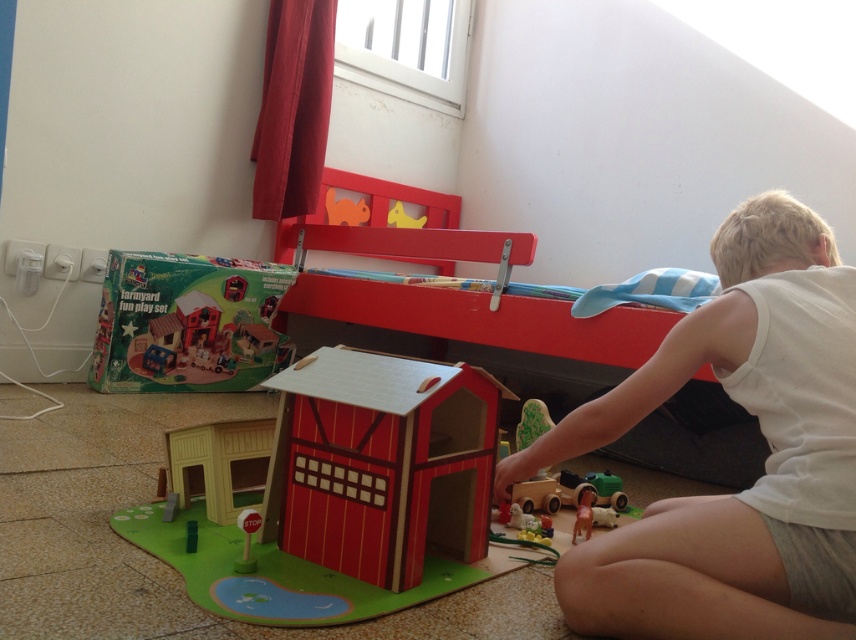
Question: Is wooden barn at center further to camera compared to matte red bunk bed at upper center?

Choices:
 (A) no
 (B) yes

Answer: (A)

Question: Can you confirm if white cotton shirt at lower right is positioned to the right of wooden barn at center?

Choices:
 (A) yes
 (B) no

Answer: (A)

Question: Where is wooden barn at center located in relation to matte red bunk bed at upper center in the image?

Choices:
 (A) right
 (B) left

Answer: (B)

Question: Estimate the real-world distances between objects in this image. Which object is closer to the matte red bunk bed at upper center?

Choices:
 (A) matte cardboard farmyard fun play set at lower left
 (B) wooden barn at center

Answer: (A)

Question: Considering the real-world distances, which object is closest to the matte red bunk bed at upper center?

Choices:
 (A) matte cardboard farmyard fun play set at lower left
 (B) white cotton shirt at lower right

Answer: (A)

Question: Which point appears farthest from the camera in this image?

Choices:
 (A) (330, 465)
 (B) (824, 412)

Answer: (A)